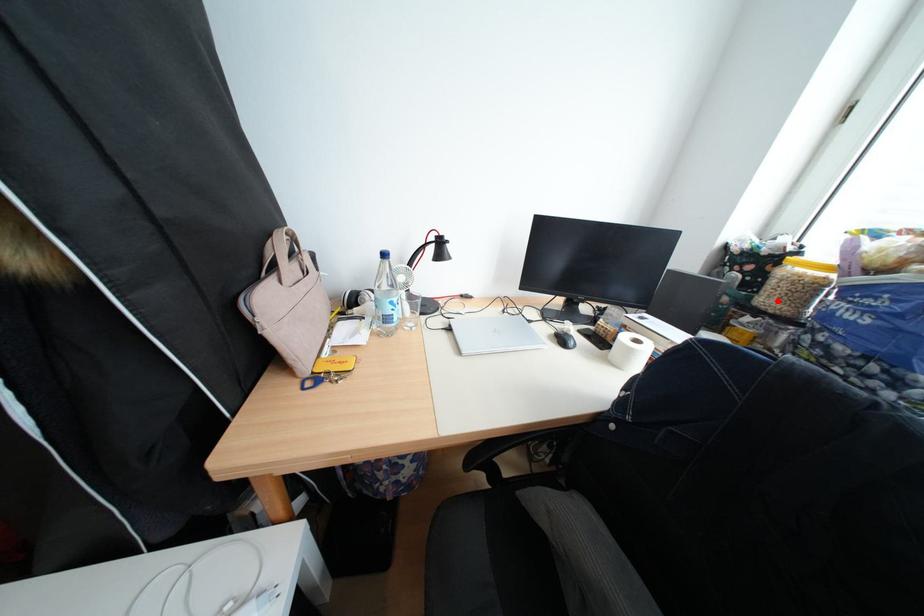
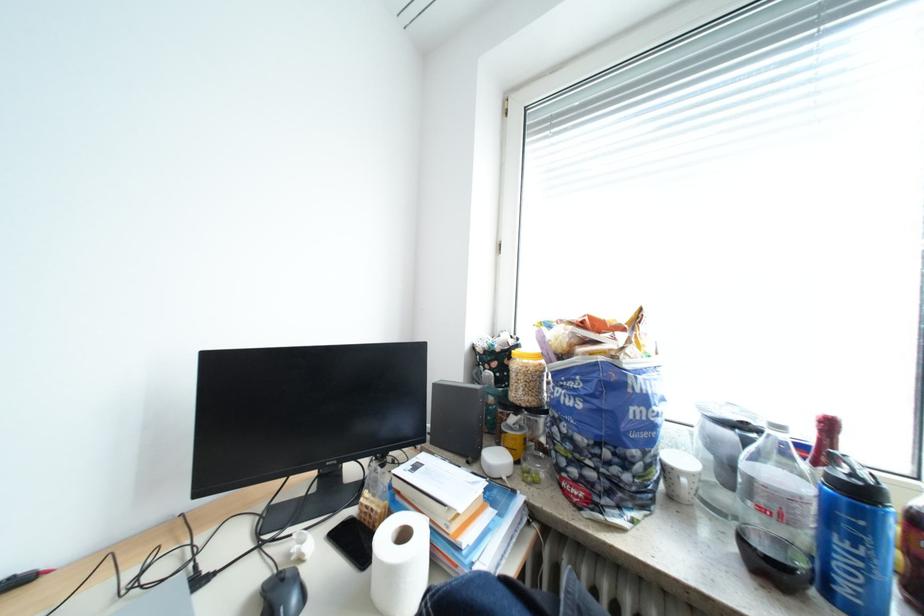
Where in the second image is the point corresponding to the highlighted location from the first image?

(529, 394)